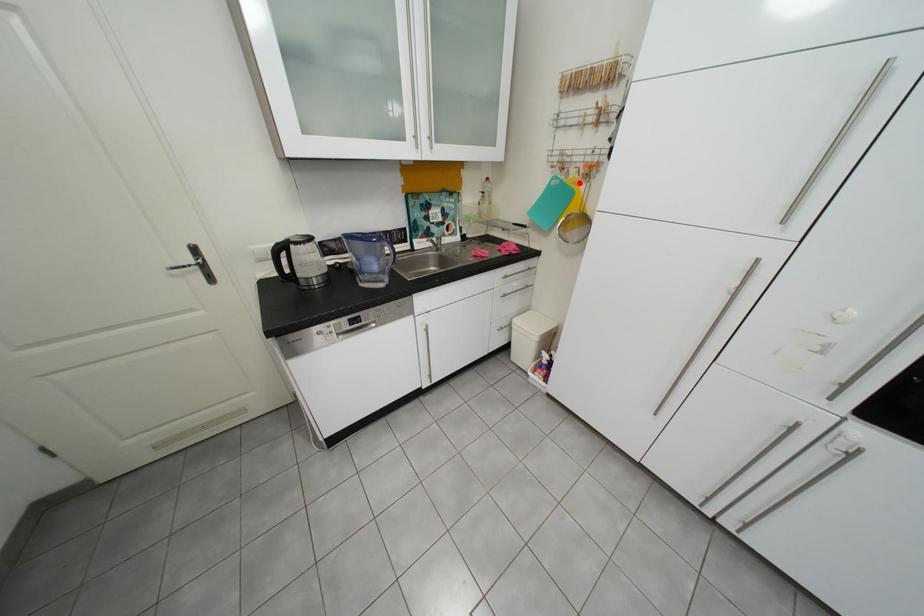
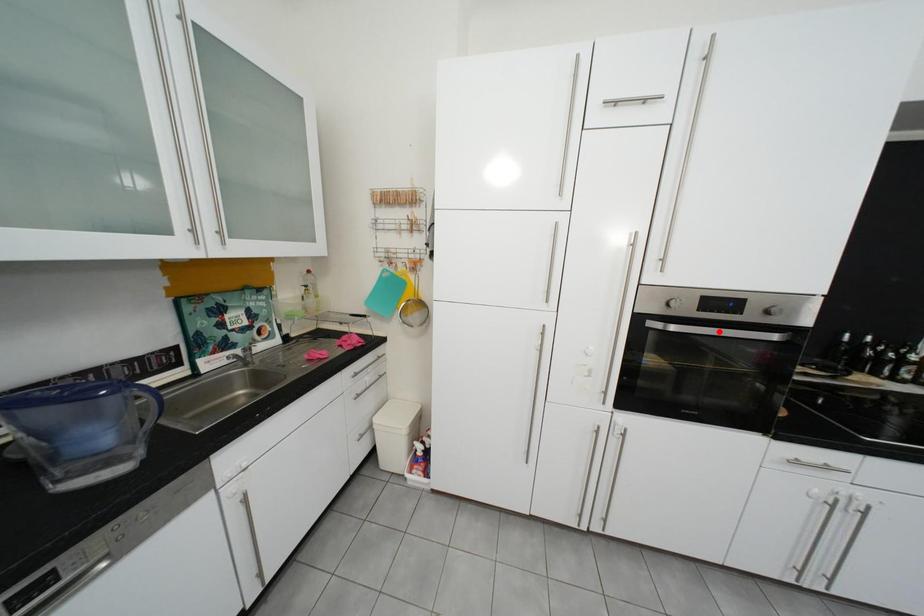
I am providing you with two images of the same scene from different viewpoints. A red point is marked on the first image and another point is marked on the second image. Do the highlighted points in image1 and image2 indicate the same real-world spot?

No